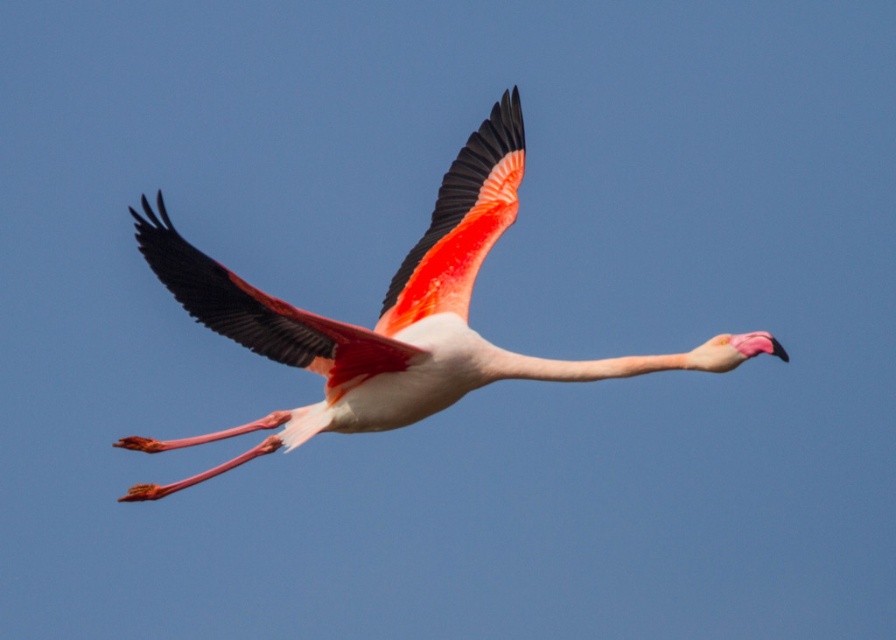
Is point (192, 436) farther from camera compared to point (367, 355)?

Yes, it is.

Does pink glossy flamingo at center have a greater height compared to matte pink wing at center?

Yes, pink glossy flamingo at center is taller than matte pink wing at center.

At what (x,y) coordinates should I click in order to perform the action: click on pink glossy flamingo at center. Please return your answer as a coordinate pair (x, y). Image resolution: width=896 pixels, height=640 pixels. Looking at the image, I should click on (392, 317).

Is matte pink wing at center smaller than vivid pink feathered wing at center?

No, matte pink wing at center is not smaller than vivid pink feathered wing at center.

Is matte pink wing at center thinner than vivid pink feathered wing at center?

Incorrect, matte pink wing at center's width is not less than vivid pink feathered wing at center's.

Is point (186, 268) in front of point (453, 188)?

Yes, point (186, 268) is in front of point (453, 188).

Locate an element on the screen. The height and width of the screenshot is (640, 896). matte pink wing at center is located at coordinates (263, 312).

Which is in front, point (324, 364) or point (453, 243)?

Point (324, 364)

Does pink glossy flamingo at center have a greater height compared to vivid pink feathered wing at center?

Yes.

This screenshot has height=640, width=896. Find the location of `pink glossy flamingo at center`. pink glossy flamingo at center is located at coordinates (392, 317).